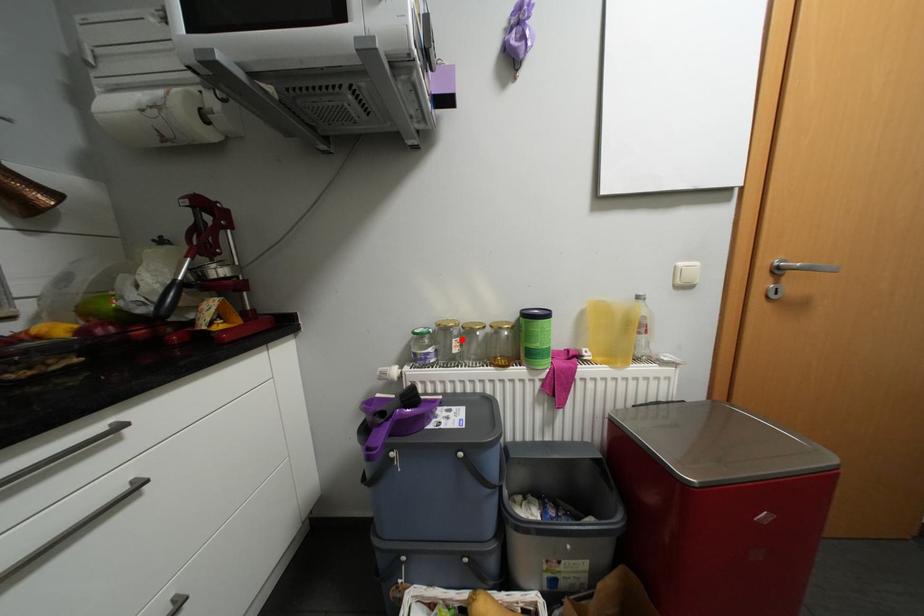
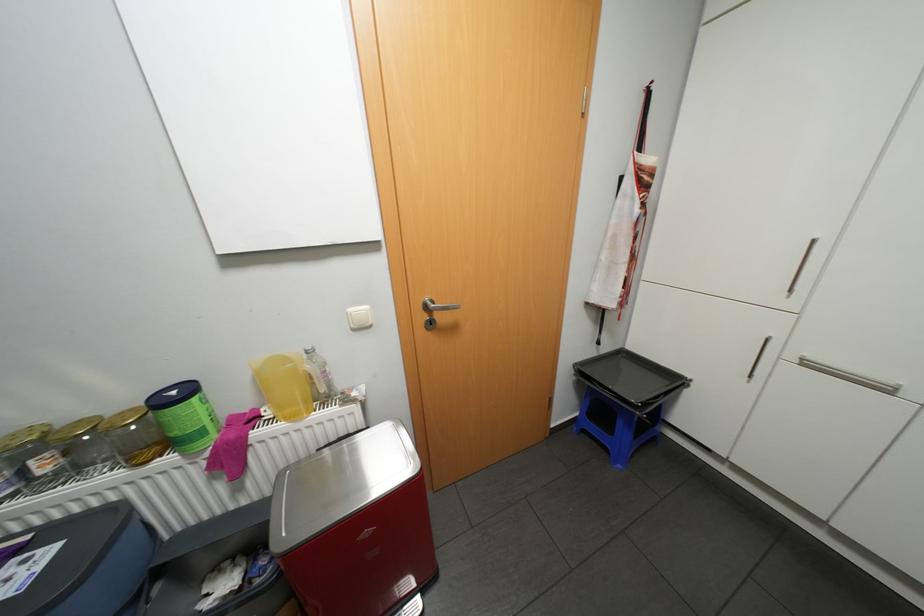
Question: I am providing you with two images of the same scene from different viewpoints. Given a red point in image1, look at the same physical point in image2. Is it:

Choices:
 (A) Closer to the viewpoint
 (B) Farther from the viewpoint

Answer: (A)